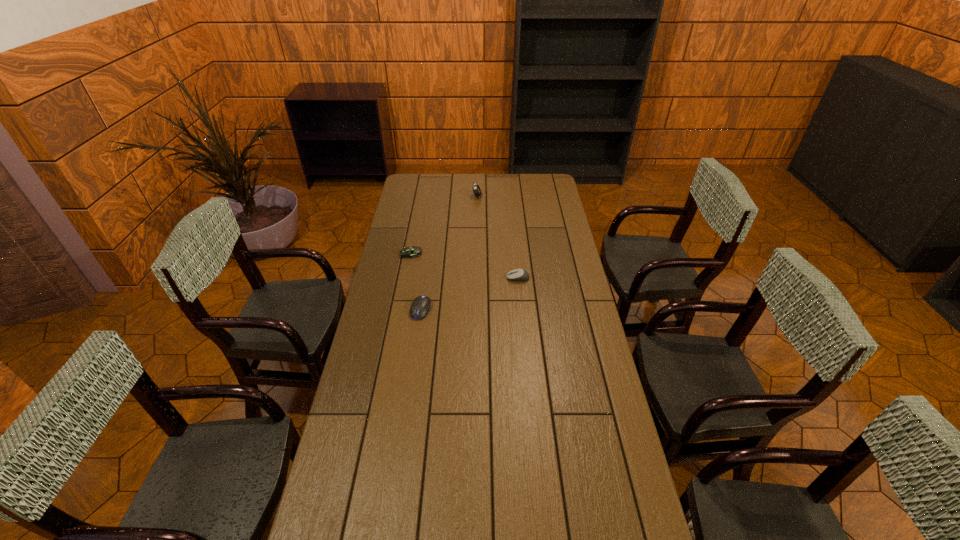
I want to click on the second object from right to left, so click(x=476, y=189).

Find the location of a particular element. the tallest object is located at coordinates (476, 189).

Where is `the nearest object`? The width and height of the screenshot is (960, 540). the nearest object is located at coordinates (420, 306).

You are a GUI agent. You are given a task and a screenshot of the screen. Output one action in this format:
    pyautogui.click(x=<x>, y=<y>)
    Task: Click on the second nearest object
    
    Given the screenshot: What is the action you would take?
    pyautogui.click(x=517, y=274)

Image resolution: width=960 pixels, height=540 pixels. I want to click on the rightmost computer mouse, so click(x=517, y=274).

Where is `the third nearest object`? Image resolution: width=960 pixels, height=540 pixels. the third nearest object is located at coordinates (406, 252).

Where is `the shortest object`? the shortest object is located at coordinates (406, 252).

I want to click on free location located 0.310m on the face of the farthest object, so click(540, 197).

I want to click on vacant space located on the front of the nearest computer mouse, so click(x=418, y=334).

Locate an element on the screen. Image resolution: width=960 pixels, height=540 pixels. vacant area located 0.330m on the wheel side of the rightmost object is located at coordinates (427, 278).